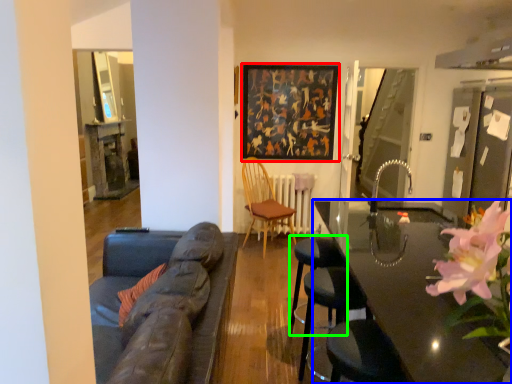
Question: Estimate the real-world distances between objects in this image. Which object is closer to picture frame (highlighted by a red box), table (highlighted by a blue box) or bar stool (highlighted by a green box)?

Choices:
 (A) table
 (B) bar stool

Answer: (A)